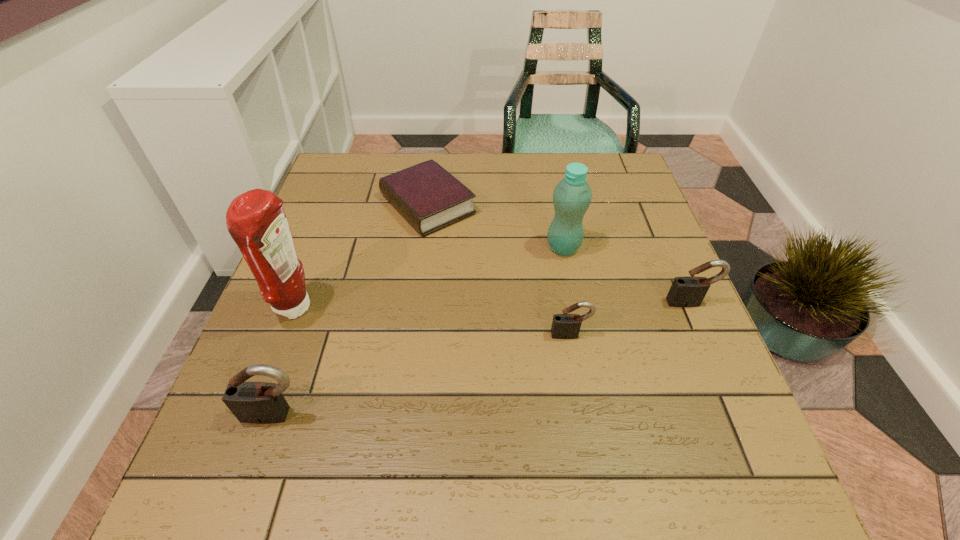
Where is `free space located 0.140m with the keyhole on the front of the second nearest padlock`? The width and height of the screenshot is (960, 540). free space located 0.140m with the keyhole on the front of the second nearest padlock is located at coordinates (582, 403).

This screenshot has height=540, width=960. What are the coordinates of `free space located 0.150m with the keyhole on the front of the rightmost padlock` in the screenshot? It's located at click(718, 368).

At what (x,y) coordinates should I click in order to perform the action: click on vacant space located 0.150m on the front of the shortest object. Please return your answer as a coordinate pair (x, y). Image resolution: width=960 pixels, height=540 pixels. Looking at the image, I should click on (417, 283).

Locate an element on the screen. free space located 0.260m at the front cap of the water bottle is located at coordinates 440,248.

This screenshot has width=960, height=540. In order to click on free location located at the front cap of the water bottle in this screenshot , I will do [x=492, y=248].

You are a GUI agent. You are given a task and a screenshot of the screen. Output one action in this format:
    pyautogui.click(x=<x>, y=<y>)
    Task: Click on the vacant space located at the front cap of the water bottle
    This screenshot has height=540, width=960.
    Given the screenshot: What is the action you would take?
    pyautogui.click(x=496, y=248)

The height and width of the screenshot is (540, 960). I want to click on vacant space located on the front of the condiment, so pos(245,439).

You are a GUI agent. You are given a task and a screenshot of the screen. Output one action in this format:
    pyautogui.click(x=<x>, y=<y>)
    Task: Click on the object that is at the far edge
    
    Given the screenshot: What is the action you would take?
    pyautogui.click(x=430, y=198)

Locate an element on the screen. The image size is (960, 540). object present at the near edge is located at coordinates (251, 402).

Where is `padlock that is positioned at the left edge`? The height and width of the screenshot is (540, 960). padlock that is positioned at the left edge is located at coordinates (251, 402).